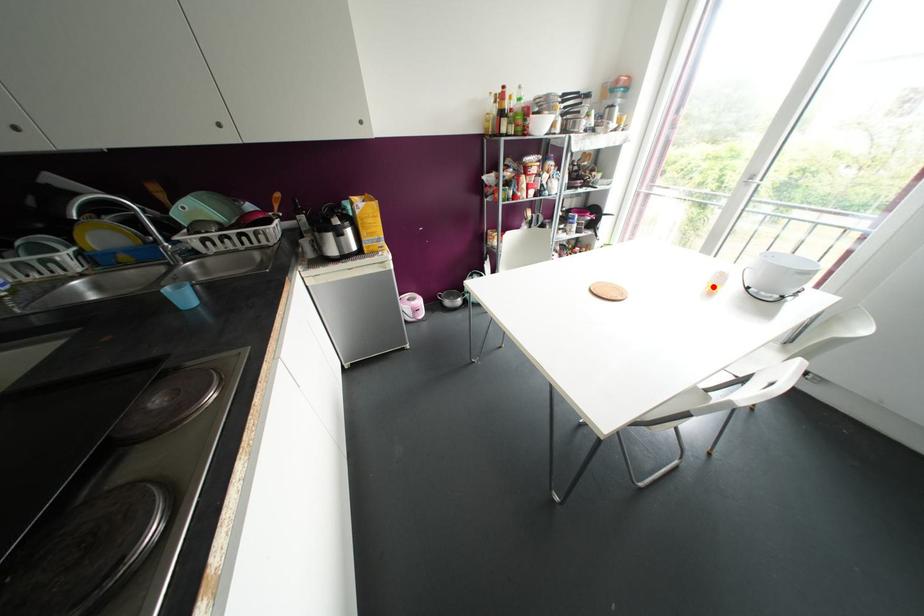
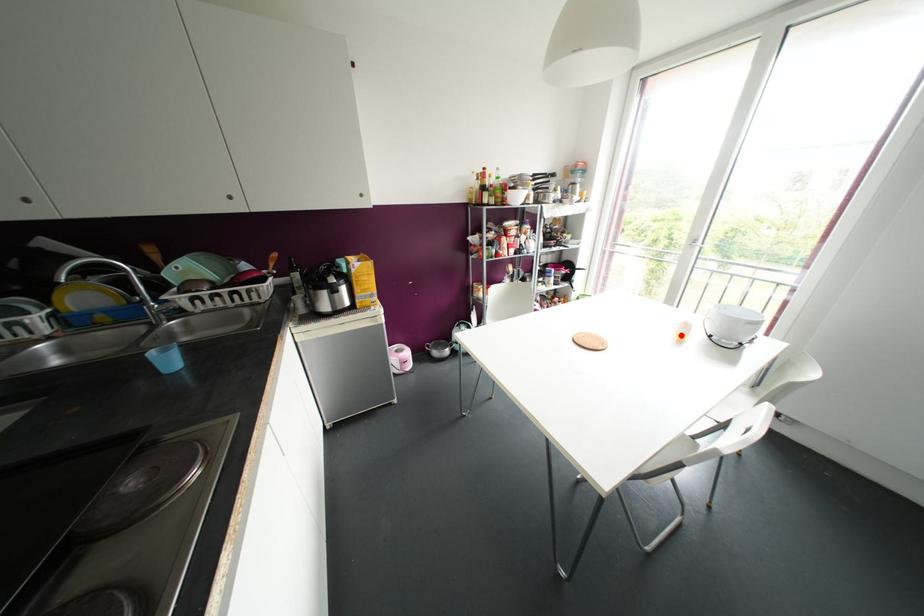
I am providing you with two images of the same scene from different viewpoints. A red point is marked on the first image and another point is marked on the second image. Is the red point in image1 aligned with the point shown in image2?

Yes